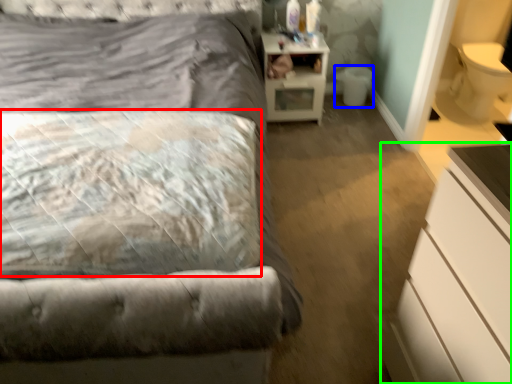
Question: Estimate the real-world distances between objects in this image. Which object is closer to pillow (highlighted by a red box), toilet bowl (highlighted by a blue box) or chest of drawers (highlighted by a green box)?

Choices:
 (A) toilet bowl
 (B) chest of drawers

Answer: (B)